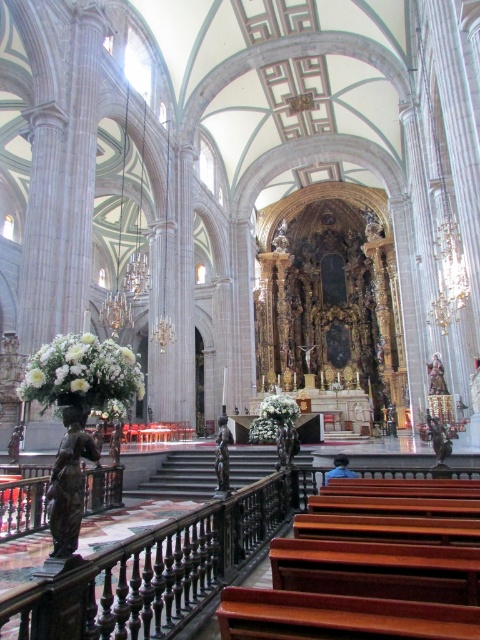
Looking at this image, you are standing in the grand cathedral and want to place a small statue on the floor near the white matte floral arrangement at left. Based on the coordinates provided, can you determine if the statue will fit in the same area?

The white matte floral arrangement at left is located at point [35,378], so the statue should fit in the same area as the coordinates indicate the position where the floral arrangement is placed.